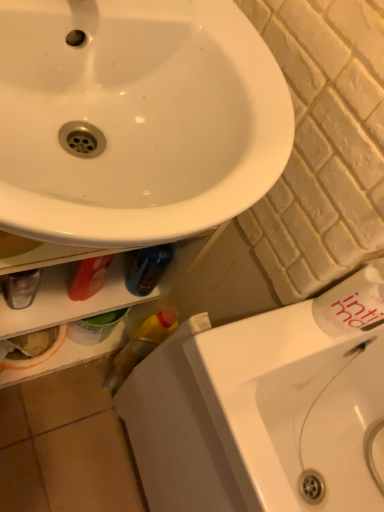
Question: Is white glossy sink at upper left not close to white textured brick at center right?

Choices:
 (A) yes
 (B) no

Answer: (B)

Question: Is white glossy sink at upper left taller than white textured brick at center right?

Choices:
 (A) yes
 (B) no

Answer: (B)

Question: Considering the relative positions of white glossy sink at upper left and white textured brick at center right in the image provided, is white glossy sink at upper left to the left of white textured brick at center right from the viewer's perspective?

Choices:
 (A) no
 (B) yes

Answer: (B)

Question: From a real-world perspective, does white glossy sink at upper left sit lower than white textured brick at center right?

Choices:
 (A) yes
 (B) no

Answer: (B)

Question: From the image's perspective, does white glossy sink at upper left appear lower than white textured brick at center right?

Choices:
 (A) no
 (B) yes

Answer: (B)

Question: Can you confirm if white glossy sink at upper left is thinner than white textured brick at center right?

Choices:
 (A) no
 (B) yes

Answer: (A)

Question: Is white textured brick at center right not near white glossy sink at upper left?

Choices:
 (A) yes
 (B) no

Answer: (B)

Question: Can you confirm if white textured brick at center right is wider than white glossy sink at upper left?

Choices:
 (A) no
 (B) yes

Answer: (A)

Question: Is white textured brick at center right to the right of white glossy sink at upper left from the viewer's perspective?

Choices:
 (A) yes
 (B) no

Answer: (A)

Question: Does white textured brick at center right have a larger size compared to white glossy sink at upper left?

Choices:
 (A) no
 (B) yes

Answer: (A)

Question: From a real-world perspective, is white textured brick at center right beneath white glossy sink at upper left?

Choices:
 (A) no
 (B) yes

Answer: (B)

Question: Considering the relative sizes of white textured brick at center right and white glossy sink at upper left in the image provided, is white textured brick at center right taller than white glossy sink at upper left?

Choices:
 (A) yes
 (B) no

Answer: (A)

Question: From a real-world perspective, does white glossy sink at lower right stand above white textured brick at center right?

Choices:
 (A) no
 (B) yes

Answer: (A)